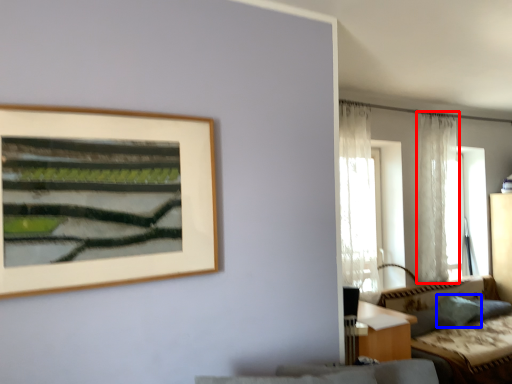
Question: Which object is closer to the camera taking this photo, curtain (highlighted by a red box) or pillow (highlighted by a blue box)?

Choices:
 (A) curtain
 (B) pillow

Answer: (B)